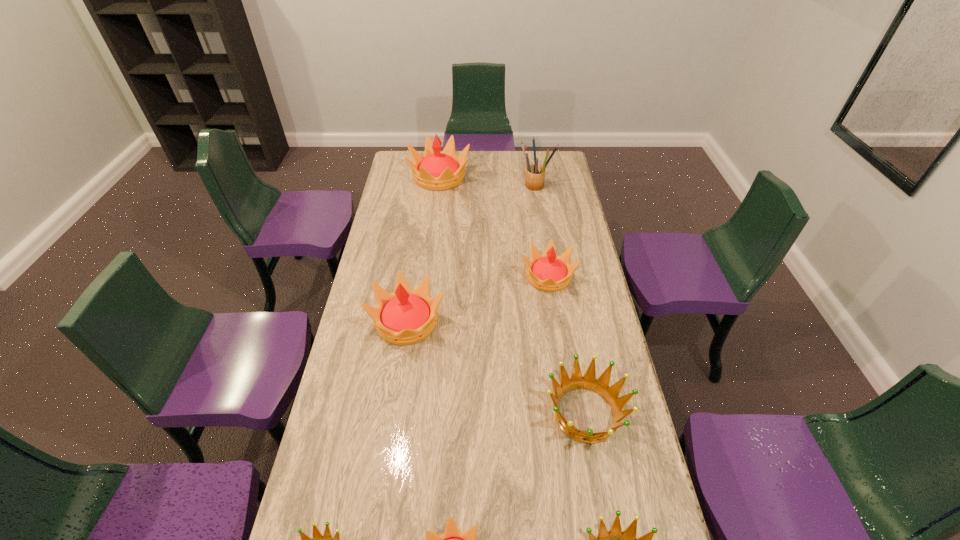
You are a GUI agent. You are given a task and a screenshot of the screen. Output one action in this format:
    pyautogui.click(x=<x>, y=<y>)
    Task: Click on the vacant space at the far right corner
    
    Given the screenshot: What is the action you would take?
    pyautogui.click(x=548, y=165)

Locate an element on the screen. free area in between the pencil box and the third tallest object is located at coordinates (471, 253).

This screenshot has height=540, width=960. I want to click on free area in between the second smallest yellow crown and the brown pencil box, so click(542, 231).

Where is `the third closest object to the pencil box`? The image size is (960, 540). the third closest object to the pencil box is located at coordinates (406, 316).

Where is `object that is the second closest to the shortest crown`? The width and height of the screenshot is (960, 540). object that is the second closest to the shortest crown is located at coordinates (600, 386).

Choose which crown is the third nearest neighbor to the second smallest yellow crown. Please provide its 2D coordinates. Your answer should be formatted as a tuple, i.e. [(x, y)], where the tuple contains the x and y coordinates of a point satisfying the conditions above.

[(435, 170)]

Where is `the third closest crown to the pencil box`? the third closest crown to the pencil box is located at coordinates (406, 316).

The height and width of the screenshot is (540, 960). In order to click on yellow crown that is the nearest to the sixth tallest crown in this screenshot , I will do `click(452, 539)`.

Identify the location of yellow crown that stands as the second closest to the smallest yellow crown. This screenshot has width=960, height=540. (548, 272).

Where is `the closest golden crown to the smallest yellow crown`? This screenshot has height=540, width=960. the closest golden crown to the smallest yellow crown is located at coordinates (318, 539).